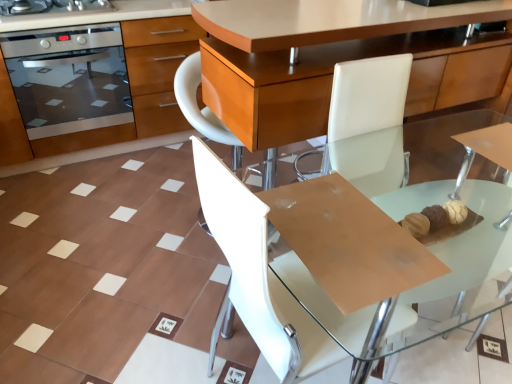
Question: Is white leather chair at center placed right next to stainless steel oven at upper left?

Choices:
 (A) no
 (B) yes

Answer: (A)

Question: From a real-world perspective, is white leather chair at center beneath stainless steel oven at upper left?

Choices:
 (A) yes
 (B) no

Answer: (A)

Question: From the image's perspective, is white leather chair at center above stainless steel oven at upper left?

Choices:
 (A) no
 (B) yes

Answer: (A)

Question: From a real-world perspective, is white leather chair at center on top of stainless steel oven at upper left?

Choices:
 (A) yes
 (B) no

Answer: (B)

Question: Considering the relative positions of white leather chair at center and stainless steel oven at upper left in the image provided, is white leather chair at center to the left of stainless steel oven at upper left from the viewer's perspective?

Choices:
 (A) yes
 (B) no

Answer: (B)

Question: From the image's perspective, is stainless steel oven at left located above or below white leather chair at center?

Choices:
 (A) below
 (B) above

Answer: (B)

Question: Is stainless steel oven at left to the left or to the right of white leather chair at center in the image?

Choices:
 (A) right
 (B) left

Answer: (B)

Question: Is stainless steel oven at left inside or outside of white leather chair at center?

Choices:
 (A) inside
 (B) outside

Answer: (B)

Question: From a real-world perspective, is stainless steel oven at left physically located above or below white leather chair at center?

Choices:
 (A) above
 (B) below

Answer: (A)

Question: In the image, is stainless steel oven at left positioned in front of or behind stainless steel oven at upper left?

Choices:
 (A) behind
 (B) front

Answer: (B)

Question: Is stainless steel oven at left wider or thinner than stainless steel oven at upper left?

Choices:
 (A) thin
 (B) wide

Answer: (B)

Question: From a real-world perspective, is stainless steel oven at left positioned above or below stainless steel oven at upper left?

Choices:
 (A) above
 (B) below

Answer: (B)

Question: Looking at the image, does stainless steel oven at left seem bigger or smaller compared to stainless steel oven at upper left?

Choices:
 (A) big
 (B) small

Answer: (A)

Question: Is stainless steel oven at left bigger or smaller than stainless steel oven at left?

Choices:
 (A) big
 (B) small

Answer: (B)

Question: From the image's perspective, is stainless steel oven at left above or below stainless steel oven at left?

Choices:
 (A) below
 (B) above

Answer: (B)